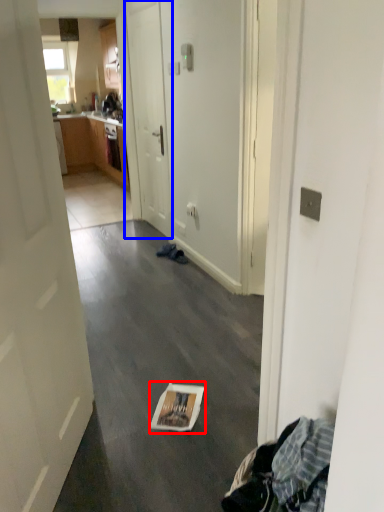
Question: Which point is further to the camera, magazine (highlighted by a red box) or door (highlighted by a blue box)?

Choices:
 (A) magazine
 (B) door

Answer: (B)